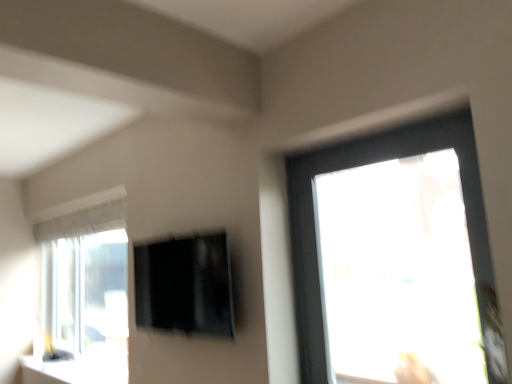
Question: Based on their sizes in the image, would you say white glossy window sill at lower left is bigger or smaller than black glossy screen at center?

Choices:
 (A) small
 (B) big

Answer: (A)

Question: Considering the positions of white glossy window sill at lower left and black glossy screen at center in the image, is white glossy window sill at lower left taller or shorter than black glossy screen at center?

Choices:
 (A) tall
 (B) short

Answer: (B)

Question: Looking at their shapes, would you say white glossy window sill at lower left is wider or thinner than black glossy screen at center?

Choices:
 (A) thin
 (B) wide

Answer: (B)

Question: From the image's perspective, is black glossy screen at center positioned above or below white glossy window sill at lower left?

Choices:
 (A) below
 (B) above

Answer: (B)

Question: From a real-world perspective, relative to white glossy window sill at lower left, is black glossy screen at center vertically above or below?

Choices:
 (A) below
 (B) above

Answer: (B)

Question: In the image, is black glossy screen at center positioned in front of or behind white glossy window sill at lower left?

Choices:
 (A) front
 (B) behind

Answer: (A)

Question: Is black glossy screen at center inside the boundaries of white glossy window sill at lower left, or outside?

Choices:
 (A) inside
 (B) outside

Answer: (B)